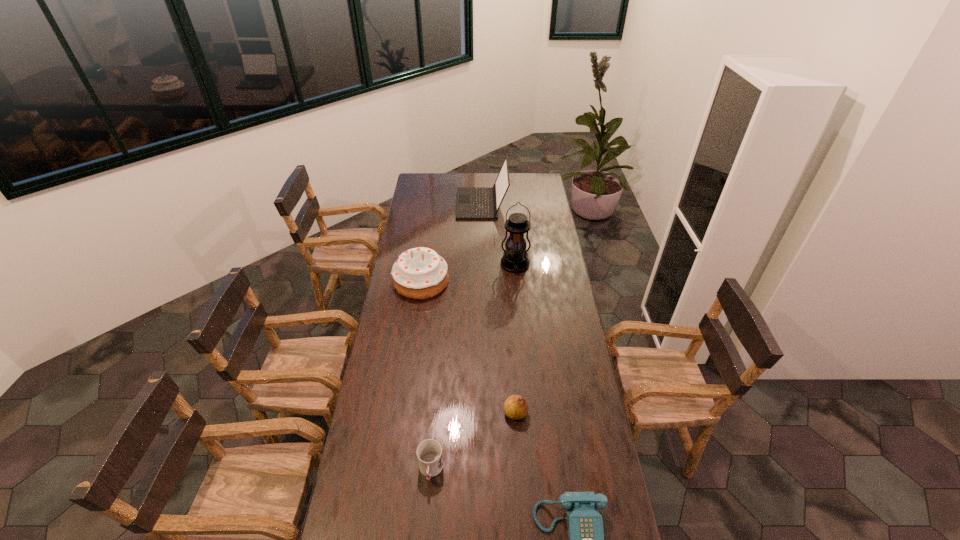
The image size is (960, 540). In order to click on free space located 0.080m on the surface of the laptop in this screenshot , I will do `click(444, 204)`.

The width and height of the screenshot is (960, 540). Identify the location of free space located on the back of the fourth shortest object. (430, 219).

Find the location of `free region located 0.220m on the front of the fourth tallest object`. free region located 0.220m on the front of the fourth tallest object is located at coordinates (520, 485).

The image size is (960, 540). In order to click on vacant space situated 0.110m on the side of the fifth farthest object where the handle is located in this screenshot , I will do `click(426, 524)`.

Where is `object located in the far edge section of the desktop`? object located in the far edge section of the desktop is located at coordinates (473, 203).

Identify the location of object positioned at the left edge. The image size is (960, 540). (420, 273).

Find the location of a particular element. The width and height of the screenshot is (960, 540). vacant area at the far edge is located at coordinates (516, 190).

This screenshot has width=960, height=540. I want to click on vacant space at the left edge of the desktop, so pos(396,331).

Locate an element on the screen. This screenshot has height=540, width=960. vacant space at the right edge is located at coordinates tap(544, 238).

In the image, there is a desktop. Where is `vacant space at the far right corner`? Image resolution: width=960 pixels, height=540 pixels. vacant space at the far right corner is located at coordinates (548, 189).